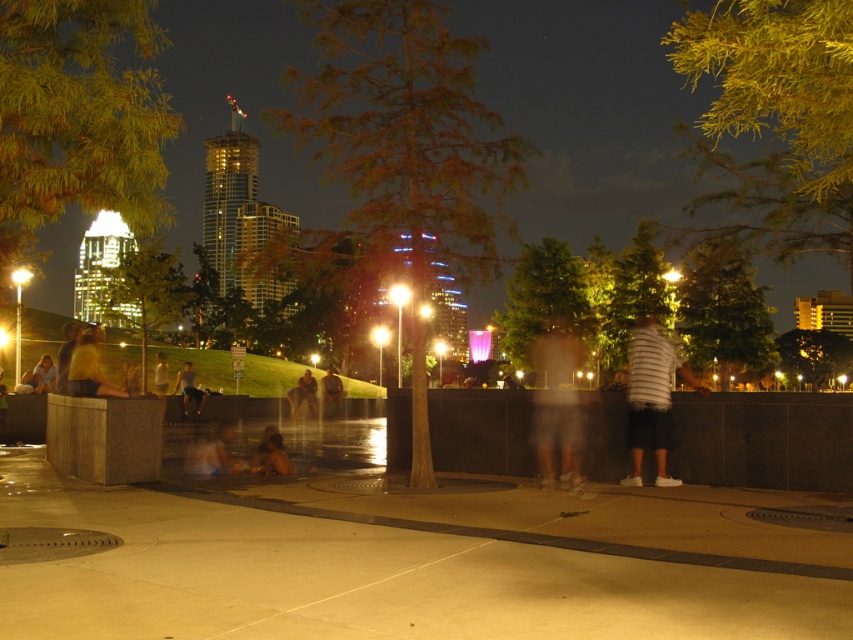
Image resolution: width=853 pixels, height=640 pixels. What do you see at coordinates (360, 579) in the screenshot?
I see `smooth concrete pavement at center` at bounding box center [360, 579].

Does smooth concrete pavement at center have a greater width compared to light brown wooden skateboard at center?

Yes, smooth concrete pavement at center is wider than light brown wooden skateboard at center.

Image resolution: width=853 pixels, height=640 pixels. What do you see at coordinates (360, 579) in the screenshot? I see `smooth concrete pavement at center` at bounding box center [360, 579].

Where is `smooth concrete pavement at center`? Image resolution: width=853 pixels, height=640 pixels. smooth concrete pavement at center is located at coordinates (360, 579).

Is smooth concrete pavement at center taller than white striped shirt at center?

In fact, smooth concrete pavement at center may be shorter than white striped shirt at center.

Describe the element at coordinates (360, 579) in the screenshot. I see `smooth concrete pavement at center` at that location.

The image size is (853, 640). I want to click on smooth concrete pavement at center, so tap(360, 579).

Between yellow fabric shirt at left and light brown wooden skateboard at center, which one appears on the left side from the viewer's perspective?

light brown wooden skateboard at center

What are the coordinates of `yellow fabric shirt at left` in the screenshot? It's located at (90, 368).

Identify the location of yellow fabric shirt at left. The width and height of the screenshot is (853, 640). (90, 368).